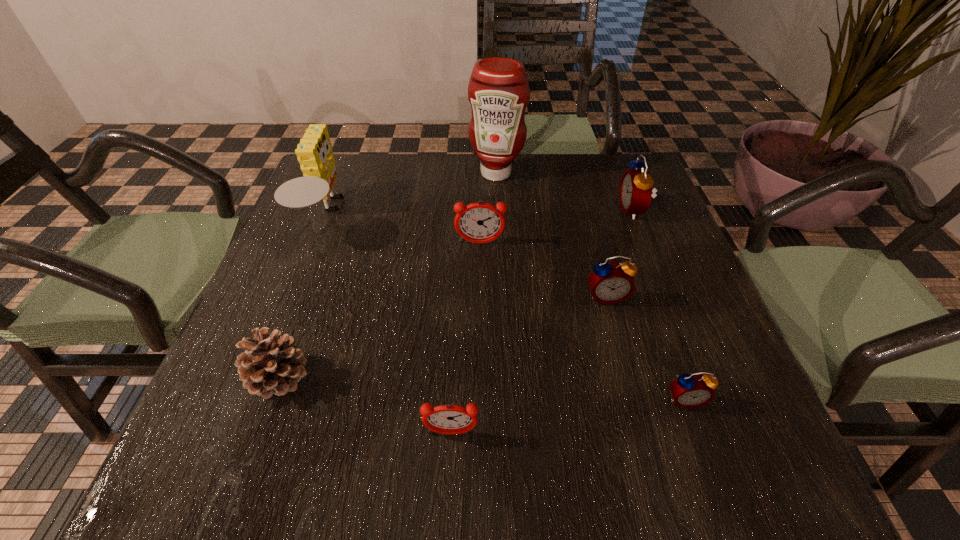
You are a GUI agent. You are given a task and a screenshot of the screen. Output one action in this format:
    pyautogui.click(x=<x>, y=<y>)
    Task: Click on the pinecone present at the left edge
    Image resolution: width=960 pixels, height=540 pixels.
    Given the screenshot: What is the action you would take?
    pyautogui.click(x=270, y=365)

Image resolution: width=960 pixels, height=540 pixels. I want to click on object at the far left corner, so click(x=314, y=152).

Where is `object situated at the far right corner`? The height and width of the screenshot is (540, 960). object situated at the far right corner is located at coordinates (636, 186).

This screenshot has height=540, width=960. In the image, there is a desktop. Identify the location of free space at the far edge. (422, 201).

The height and width of the screenshot is (540, 960). What are the coordinates of `vacant position at the near edge of the desktop` in the screenshot? It's located at (316, 438).

You are a GUI agent. You are given a task and a screenshot of the screen. Output one action in this format:
    pyautogui.click(x=<x>, y=<y>)
    Task: Click on the free space at the left edge of the desktop
    
    Given the screenshot: What is the action you would take?
    pyautogui.click(x=323, y=248)

Locate an element on the screen. This screenshot has width=960, height=540. free point at the right edge is located at coordinates (666, 268).

Find the location of a particular element. vacant space at the near left corner of the desktop is located at coordinates (245, 466).

In the image, there is a desktop. Where is `vacant space at the far right corner`? Image resolution: width=960 pixels, height=540 pixels. vacant space at the far right corner is located at coordinates (591, 173).

The width and height of the screenshot is (960, 540). In the image, there is a desktop. In order to click on vacant space at the near right corner in this screenshot , I will do `click(702, 447)`.